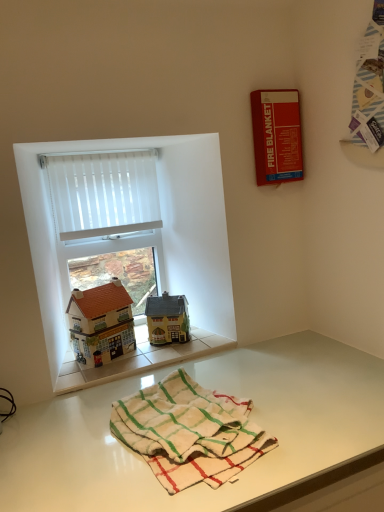
Locate an element on the screen. Image resolution: width=384 pixels, height=512 pixels. vacant space to the right of white cotton bath towel at lower center is located at coordinates (327, 408).